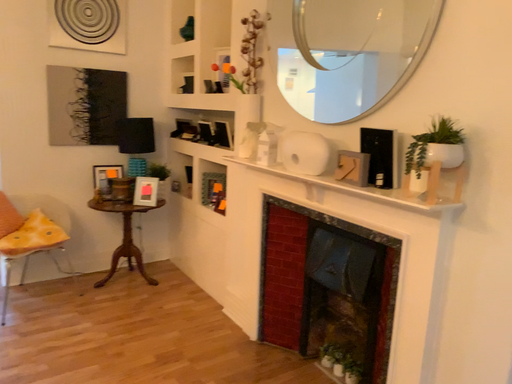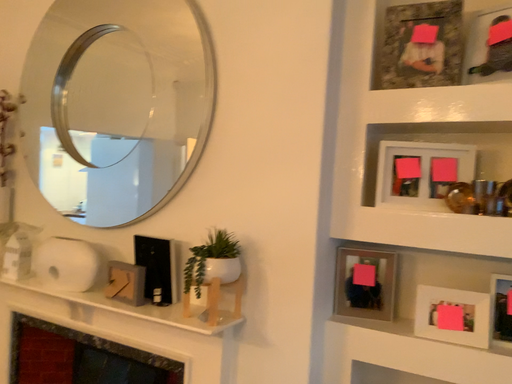
Question: Which way did the camera rotate in the video?

Choices:
 (A) rotated upward
 (B) rotated downward

Answer: (A)